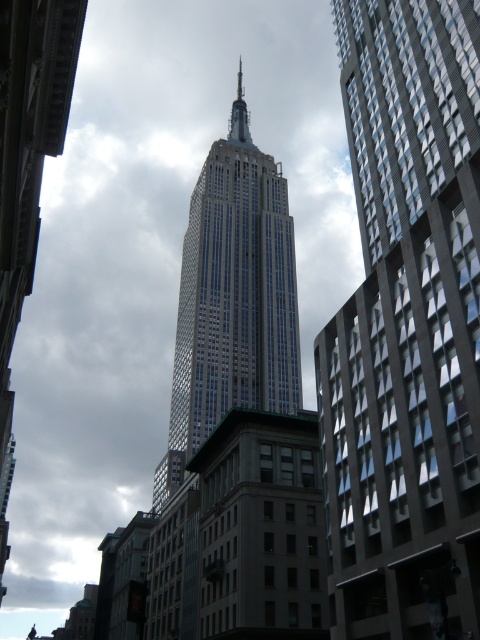
Question: Among these objects, which one is farthest from the camera?

Choices:
 (A) gray glass skyscraper at right
 (B) glassy steel tower at center

Answer: (B)

Question: Is gray glass skyscraper at right to the right of glassy steel tower at center from the viewer's perspective?

Choices:
 (A) yes
 (B) no

Answer: (A)

Question: Among these objects, which one is nearest to the camera?

Choices:
 (A) gray glass skyscraper at right
 (B) glassy steel tower at center

Answer: (A)

Question: Does gray glass skyscraper at right lie in front of glassy steel tower at center?

Choices:
 (A) yes
 (B) no

Answer: (A)

Question: Is gray glass skyscraper at right above glassy steel tower at center?

Choices:
 (A) no
 (B) yes

Answer: (A)

Question: Which object appears farthest from the camera in this image?

Choices:
 (A) gray glass skyscraper at right
 (B) glassy steel tower at center

Answer: (B)